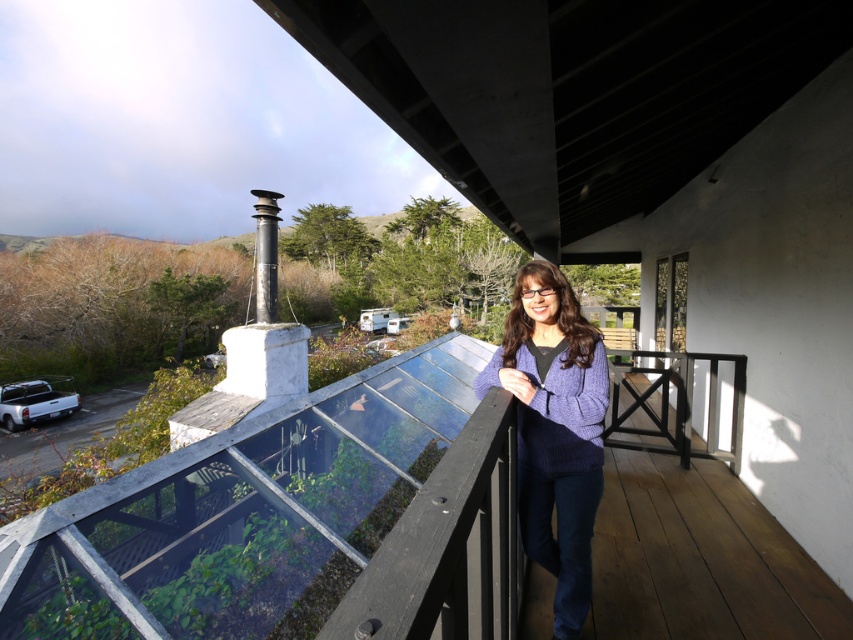
You are a painter standing on the wooden porch at center and want to paint the purple knitted sweater at center. Which object is taller so that you can decide where to place your easel?

The purple knitted sweater at center is taller than the wooden porch at center, so you should place your easel where you can see the top of the sweater clearly.

You are a fashion designer observing the scene. You need to determine if the purple knitted sweater at center can be stretched to fit over the black metallic chimney at upper left. Can it?

The purple knitted sweater at center is thinner than the black metallic chimney at upper left, so it cannot be stretched to fit over it.